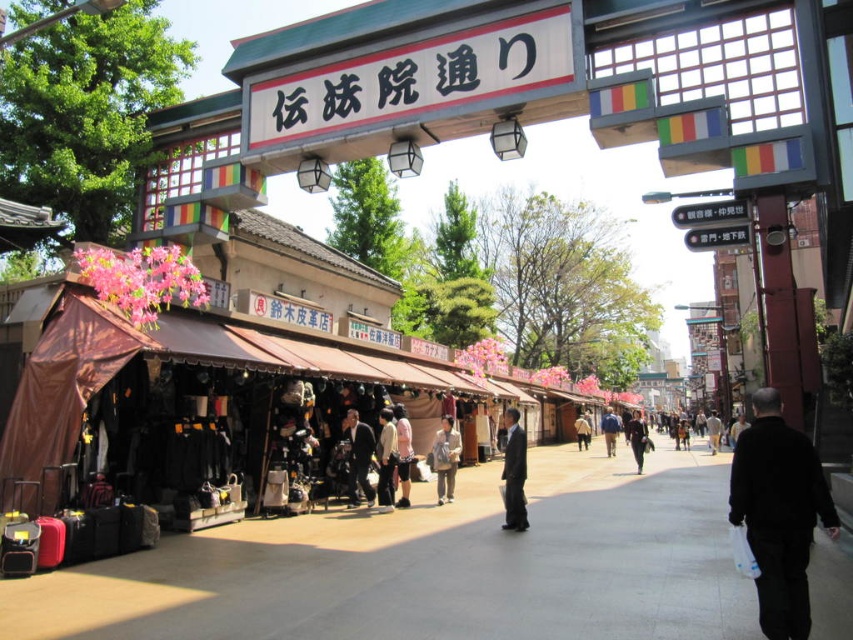
Can you confirm if pink fabric shorts at center is bigger than blue fabric jacket at center?

Incorrect, pink fabric shorts at center is not larger than blue fabric jacket at center.

Does pink fabric shorts at center appear over blue fabric jacket at center?

Yes.

Find the location of a particular element. The image size is (853, 640). pink fabric shorts at center is located at coordinates (402, 452).

This screenshot has width=853, height=640. Find the location of `pink fabric shorts at center`. pink fabric shorts at center is located at coordinates (402, 452).

Can you confirm if dark gray suit at center is taller than black leather jacket at center?

In fact, dark gray suit at center may be shorter than black leather jacket at center.

Where is `dark gray suit at center`? dark gray suit at center is located at coordinates (358, 458).

Does light brown leather bag at center come behind light beige fabric pants at center?

Yes, it is behind light beige fabric pants at center.

Which is behind, point (434, 470) or point (392, 419)?

The point (434, 470) is more distant.

Image resolution: width=853 pixels, height=640 pixels. Find the location of `light brown leather bag at center`. light brown leather bag at center is located at coordinates (445, 460).